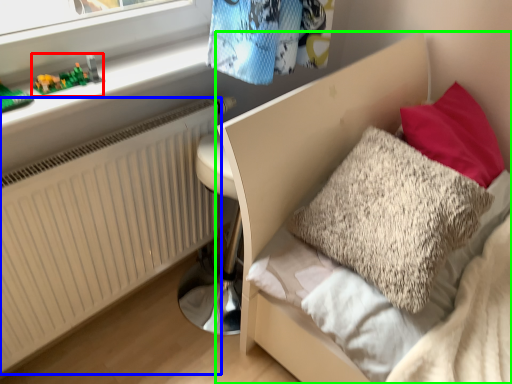
Question: Which is nearer to the toy (highlighted by a red box)? radiator (highlighted by a blue box) or bed (highlighted by a green box).

Choices:
 (A) radiator
 (B) bed

Answer: (A)